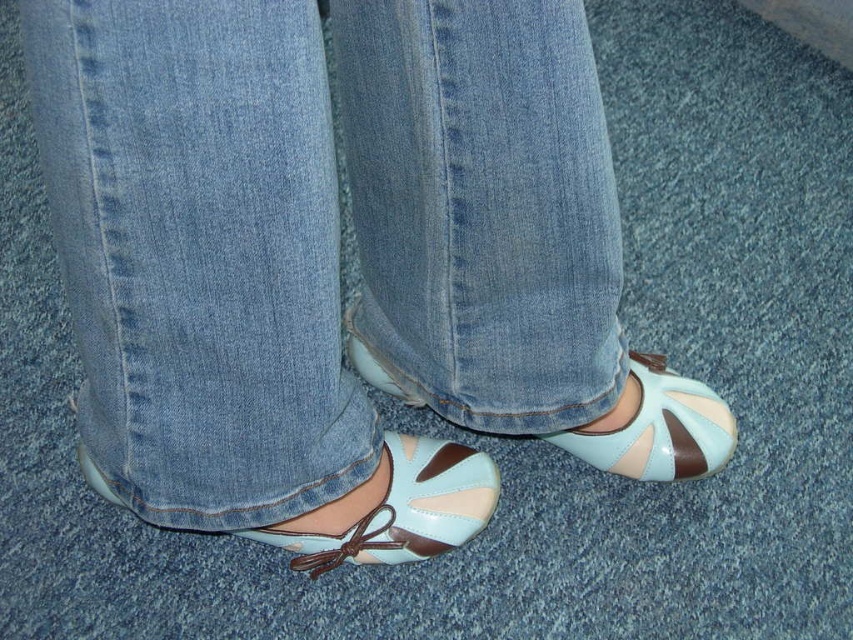
Can you confirm if light blue patent leather sandal at center is smaller than light blue patent leather shoe at center?

Correct, light blue patent leather sandal at center occupies less space than light blue patent leather shoe at center.

Is light blue patent leather sandal at center to the right of light blue patent leather shoe at center from the viewer's perspective?

Indeed, light blue patent leather sandal at center is positioned on the right side of light blue patent leather shoe at center.

Locate an element on the screen. This screenshot has height=640, width=853. light blue patent leather sandal at center is located at coordinates (659, 428).

Is light blue patent leather sandal at lower center to the right of light blue patent leather shoe at center from the viewer's perspective?

Correct, you'll find light blue patent leather sandal at lower center to the right of light blue patent leather shoe at center.

Does light blue patent leather sandal at lower center have a lesser height compared to light blue patent leather shoe at center?

In fact, light blue patent leather sandal at lower center may be taller than light blue patent leather shoe at center.

This screenshot has height=640, width=853. What are the coordinates of `light blue patent leather sandal at lower center` in the screenshot? It's located at (403, 509).

Identify the location of light blue patent leather sandal at lower center. The image size is (853, 640). (x=403, y=509).

Can you confirm if light blue patent leather sandal at lower center is bigger than light blue patent leather sandal at center?

Yes.

Identify the location of light blue patent leather sandal at lower center. (403, 509).